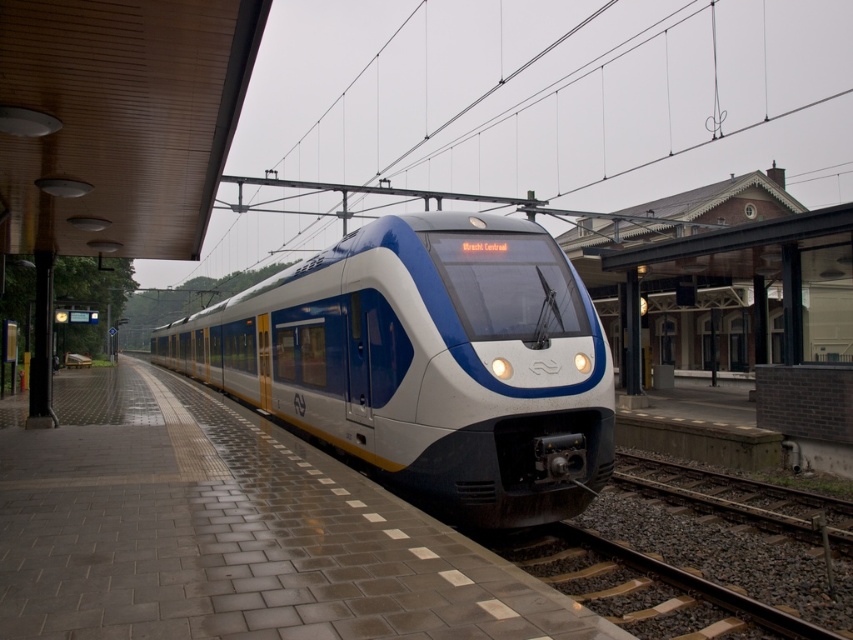
Looking at this image, can you confirm if brick platform at center is bigger than matte white train at center?

Incorrect, brick platform at center is not larger than matte white train at center.

Does point (370, 547) come farther from viewer compared to point (519, 483)?

That is False.

Identify the location of brick platform at center. (231, 532).